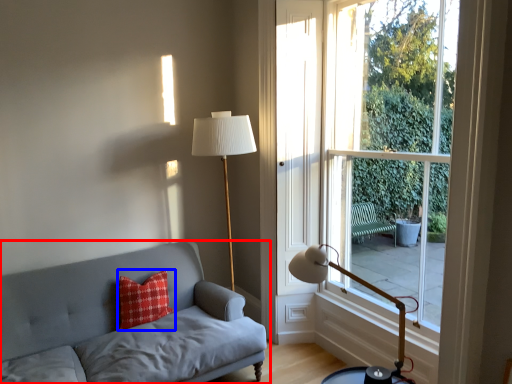
Question: Which point is closer to the camera, studio couch (highlighted by a red box) or pillow (highlighted by a blue box)?

Choices:
 (A) studio couch
 (B) pillow

Answer: (A)